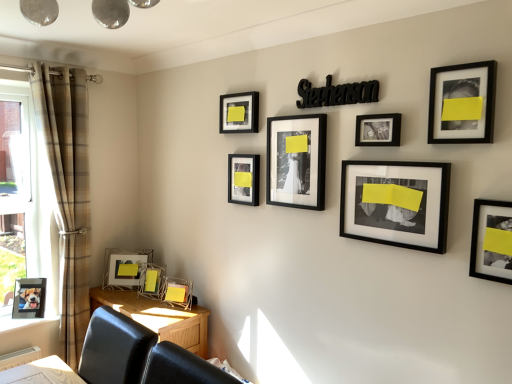
What do you see at coordinates (239, 113) in the screenshot? I see `matte black picture frame at upper center, acting as the seventh picture frame starting from the right` at bounding box center [239, 113].

How much space does metallic silver picture frame at lower left, placed as the 1th picture frame when sorted from left to right, occupy vertically?

metallic silver picture frame at lower left, placed as the 1th picture frame when sorted from left to right, is 10.03 inches in height.

Identify the location of clear glass window at left. The height and width of the screenshot is (384, 512). (32, 192).

Where is `brown plaid curtain at left`? The height and width of the screenshot is (384, 512). brown plaid curtain at left is located at coordinates (68, 191).

Can you confirm if brown plaid curtain at left is bigger than matte black photo frame at center, arranged as the fifth picture frame when viewed from the left?

Correct, brown plaid curtain at left is larger in size than matte black photo frame at center, arranged as the fifth picture frame when viewed from the left.

Is brown plaid curtain at left far away from matte black photo frame at center, the 6th picture frame from the right?

That's right, there is a large distance between brown plaid curtain at left and matte black photo frame at center, the 6th picture frame from the right.

Which object is wider, brown plaid curtain at left or matte black photo frame at center, arranged as the fifth picture frame when viewed from the left?

Wider between the two is brown plaid curtain at left.

Is brown plaid curtain at left behind matte black photo frame at center, arranged as the fifth picture frame when viewed from the left?

Yes, brown plaid curtain at left is behind matte black photo frame at center, arranged as the fifth picture frame when viewed from the left.

Is black matte picture frame at upper right, arranged as the ninth picture frame when viewed from the left, facing towards black matte photo frame at center right, arranged as the eighth picture frame when viewed from the left?

No, black matte picture frame at upper right, arranged as the ninth picture frame when viewed from the left, is not turned towards black matte photo frame at center right, arranged as the eighth picture frame when viewed from the left.

Can you tell me how much black matte picture frame at upper right, arranged as the ninth picture frame when viewed from the left, and black matte photo frame at center right, arranged as the eighth picture frame when viewed from the left, differ in facing direction?

They differ by 0.00125 degrees in their facing directions.

Is black matte picture frame at upper right, the second picture frame viewed from the right, positioned beyond the bounds of black matte photo frame at center right, arranged as the eighth picture frame when viewed from the left?

Yes.

Which of these two, black matte picture frame at upper right, arranged as the ninth picture frame when viewed from the left, or black matte photo frame at center right, which is the 3th picture frame in right-to-left order, is smaller?

With smaller size is black matte picture frame at upper right, arranged as the ninth picture frame when viewed from the left.

Is black matte photo frame at center right, which is the 3th picture frame in right-to-left order, facing towards metallic silver picture frame at lower left, placed as the 1th picture frame when sorted from left to right?

No, black matte photo frame at center right, which is the 3th picture frame in right-to-left order, is not turned towards metallic silver picture frame at lower left, placed as the 1th picture frame when sorted from left to right.

From the image's perspective, which one is positioned lower, black matte photo frame at center right, which is the 3th picture frame in right-to-left order, or metallic silver picture frame at lower left, which ranks as the tenth picture frame in right-to-left order?

metallic silver picture frame at lower left, which ranks as the tenth picture frame in right-to-left order.

Based on the photo, which is correct: black matte photo frame at center right, arranged as the eighth picture frame when viewed from the left, is inside metallic silver picture frame at lower left, placed as the 1th picture frame when sorted from left to right, or outside of it?

black matte photo frame at center right, arranged as the eighth picture frame when viewed from the left, is located beyond the bounds of metallic silver picture frame at lower left, placed as the 1th picture frame when sorted from left to right.

Is black matte photo frame at center right, which is the 3th picture frame in right-to-left order, beside metallic silver picture frame at lower left, placed as the 1th picture frame when sorted from left to right?

No, black matte photo frame at center right, which is the 3th picture frame in right-to-left order, is not next to metallic silver picture frame at lower left, placed as the 1th picture frame when sorted from left to right.

From their relative heights in the image, would you say metallic silver picture frame at lower left, the 2th picture frame in the left-to-right sequence, is taller or shorter than black matte picture frame at center, acting as the 5th picture frame starting from the right?

Clearly, metallic silver picture frame at lower left, the 2th picture frame in the left-to-right sequence, is shorter compared to black matte picture frame at center, acting as the 5th picture frame starting from the right.

Considering their positions, is metallic silver picture frame at lower left, the 2th picture frame in the left-to-right sequence, located in front of or behind black matte picture frame at center, the sixth picture frame viewed from the left?

Clearly, metallic silver picture frame at lower left, the 2th picture frame in the left-to-right sequence, is behind black matte picture frame at center, the sixth picture frame viewed from the left.

Is metallic silver picture frame at lower left, the 2th picture frame in the left-to-right sequence, turned away from black matte picture frame at center, acting as the 5th picture frame starting from the right?

metallic silver picture frame at lower left, the 2th picture frame in the left-to-right sequence, is not turned away from black matte picture frame at center, acting as the 5th picture frame starting from the right.

Who is bigger, metallic silver picture frame at lower left, the 2th picture frame in the left-to-right sequence, or black matte picture frame at center, the sixth picture frame viewed from the left?

Bigger between the two is metallic silver picture frame at lower left, the 2th picture frame in the left-to-right sequence.

Considering the positions of objects clear glass window at left and black matte picture frame at center, acting as the 5th picture frame starting from the right, in the image provided, who is more to the right, clear glass window at left or black matte picture frame at center, acting as the 5th picture frame starting from the right,?

black matte picture frame at center, acting as the 5th picture frame starting from the right.

From the image's perspective, is clear glass window at left below black matte picture frame at center, acting as the 5th picture frame starting from the right?

Correct, clear glass window at left appears lower than black matte picture frame at center, acting as the 5th picture frame starting from the right, in the image.

Is clear glass window at left positioned far away from black matte picture frame at center, the sixth picture frame viewed from the left?

clear glass window at left is positioned a significant distance from black matte picture frame at center, the sixth picture frame viewed from the left.

Between clear glass window at left and black matte picture frame at center, the sixth picture frame viewed from the left, which one has smaller size?

black matte picture frame at center, the sixth picture frame viewed from the left.

Would you say wooden table at lower left is outside matte glass picture frame at lower left, which is counted as the 3th picture frame, starting from the left?

Indeed, wooden table at lower left is completely outside matte glass picture frame at lower left, which is counted as the 3th picture frame, starting from the left.

Looking at the image, does wooden table at lower left seem bigger or smaller compared to matte glass picture frame at lower left, which is counted as the 3th picture frame, starting from the left?

Considering their sizes, wooden table at lower left takes up more space than matte glass picture frame at lower left, which is counted as the 3th picture frame, starting from the left.

Which object is closer to the camera, wooden table at lower left or matte glass picture frame at lower left, the 8th picture frame viewed from the right?

wooden table at lower left.

From a real-world perspective, which is physically above, matte black photo frame at right, marked as the 10th picture frame in a left-to-right arrangement, or black matte sign at upper center?

black matte sign at upper center.

Looking at this image, in terms of width, does matte black photo frame at right, positioned as the first picture frame in right-to-left order, look wider or thinner when compared to black matte sign at upper center?

In the image, matte black photo frame at right, positioned as the first picture frame in right-to-left order, appears to be wider than black matte sign at upper center.

Is matte black photo frame at right, marked as the 10th picture frame in a left-to-right arrangement, facing away from black matte sign at upper center?

No, matte black photo frame at right, marked as the 10th picture frame in a left-to-right arrangement, is not facing the opposite direction of black matte sign at upper center.

Locate an element on the screen. curtain behind the matte black photo frame at center, arranged as the fifth picture frame when viewed from the left is located at coordinates (68, 191).

I want to click on the 1st picture frame to the right when counting from the black matte photo frame at center right, arranged as the eighth picture frame when viewed from the left, so click(x=462, y=103).

Which object lies further to the anchor point matte glass picture frame at lower left, which is counted as the 3th picture frame, starting from the left, matte black picture frame at upper center, acting as the seventh picture frame starting from the right, or black glossy photo frame at upper center, arranged as the seventh picture frame when viewed from the left?

The object further to matte glass picture frame at lower left, which is counted as the 3th picture frame, starting from the left, is black glossy photo frame at upper center, arranged as the seventh picture frame when viewed from the left.

Which object lies nearer to the anchor point black matte sign at upper center, matte black photo frame at center, the 6th picture frame from the right, or black matte picture frame at upper right, the second picture frame viewed from the right?

black matte picture frame at upper right, the second picture frame viewed from the right, is positioned closer to the anchor black matte sign at upper center.

From the picture: Considering their positions, is black matte sign at upper center positioned closer to clear glass window at left than brown plaid curtain at left?

brown plaid curtain at left lies closer to clear glass window at left than the other object.

Based on their spatial positions, is black matte picture frame at center, acting as the 5th picture frame starting from the right, or wooden table at lower left closer to black glossy photo frame at upper center, arranged as the seventh picture frame when viewed from the left?

black matte picture frame at center, acting as the 5th picture frame starting from the right, is closer to black glossy photo frame at upper center, arranged as the seventh picture frame when viewed from the left.

Considering their positions, is metallic silver picture frame at lower left, the 2th picture frame in the left-to-right sequence, positioned closer to brown plaid curtain at left than clear glass window at left?

Based on the image, clear glass window at left appears to be nearer to brown plaid curtain at left.

From the image, which object appears to be farther from black matte sign at upper center, black matte photo frame at center right, arranged as the eighth picture frame when viewed from the left, or black glossy photo frame at upper center, arranged as the seventh picture frame when viewed from the left?

The object further to black matte sign at upper center is black matte photo frame at center right, arranged as the eighth picture frame when viewed from the left.

Based on their spatial positions, is black glossy photo frame at upper center, arranged as the seventh picture frame when viewed from the left, or matte black photo frame at right, positioned as the first picture frame in right-to-left order, closer to metallic silver picture frame at lower left, which appears as the ninth picture frame when viewed from the right?

black glossy photo frame at upper center, arranged as the seventh picture frame when viewed from the left, is closer to metallic silver picture frame at lower left, which appears as the ninth picture frame when viewed from the right.

From the image, which object appears to be nearer to matte glass picture frame at lower left, which is counted as the 3th picture frame, starting from the left, metallic silver picture frame at lower left, placed as the 1th picture frame when sorted from left to right, or black matte picture frame at upper right, arranged as the ninth picture frame when viewed from the left?

metallic silver picture frame at lower left, placed as the 1th picture frame when sorted from left to right, lies closer to matte glass picture frame at lower left, which is counted as the 3th picture frame, starting from the left, than the other object.

This screenshot has height=384, width=512. Identify the location of writing between black matte picture frame at upper right, the second picture frame viewed from the right, and matte black photo frame at center, arranged as the fifth picture frame when viewed from the left, in the front-back direction. (336, 93).

This screenshot has width=512, height=384. I want to click on writing between brown plaid curtain at left and black matte picture frame at upper right, the second picture frame viewed from the right, so click(336, 93).

You are a GUI agent. You are given a task and a screenshot of the screen. Output one action in this format:
    pyautogui.click(x=<x>, y=<y>)
    Task: Click on the writing located between matte black picture frame at upper center, which is the 4th picture frame from left to right, and black matte picture frame at upper right, arranged as the ninth picture frame when viewed from the left, in the left-right direction
    The image size is (512, 384).
    Given the screenshot: What is the action you would take?
    pyautogui.click(x=336, y=93)

Locate an element on the screen. table between metallic silver picture frame at lower left, which ranks as the tenth picture frame in right-to-left order, and matte black photo frame at right, marked as the 10th picture frame in a left-to-right arrangement is located at coordinates (159, 318).